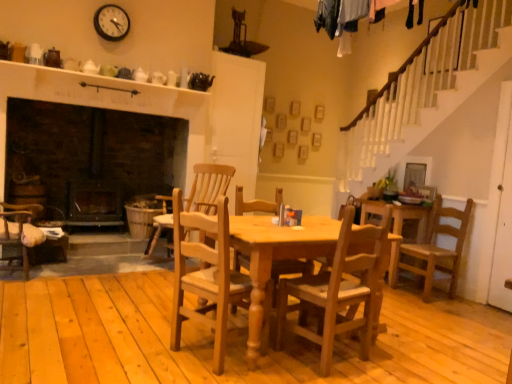
Question: Considering the relative positions of light brown wooden chair at right, the 3th chair viewed from the front, and light brown wood chair at center, which appears as the fourth chair when viewed from the right, in the image provided, is light brown wooden chair at right, the 3th chair viewed from the front, in front of light brown wood chair at center, which appears as the fourth chair when viewed from the right,?

Choices:
 (A) yes
 (B) no

Answer: (A)

Question: Is light brown wooden chair at right, the 3th chair viewed from the front, located outside light brown wood chair at center, which appears as the fourth chair when viewed from the right?

Choices:
 (A) yes
 (B) no

Answer: (A)

Question: Considering the relative sizes of light brown wooden chair at right, acting as the 1th chair starting from the right, and light brown wood chair at center, acting as the fourth chair starting from the front, in the image provided, is light brown wooden chair at right, acting as the 1th chair starting from the right, taller than light brown wood chair at center, acting as the fourth chair starting from the front,?

Choices:
 (A) no
 (B) yes

Answer: (A)

Question: Does light brown wooden chair at right, acting as the 1th chair starting from the right, have a smaller size compared to light brown wood chair at center, acting as the fourth chair starting from the front?

Choices:
 (A) yes
 (B) no

Answer: (A)

Question: Is there a large distance between light brown wooden chair at right, acting as the 1th chair starting from the right, and light brown wood chair at center, which appears as the fourth chair when viewed from the right?

Choices:
 (A) yes
 (B) no

Answer: (A)

Question: From a real-world perspective, is light brown wooden chair at right, the second chair from the back, located higher than light brown wood chair at center, arranged as the 1th chair when viewed from the back?

Choices:
 (A) no
 (B) yes

Answer: (A)

Question: Can you see light brown wood chair at center, the first chair when ordered from left to right, touching wooden chair at center, placed as the third chair when sorted from left to right?

Choices:
 (A) no
 (B) yes

Answer: (A)

Question: From a real-world perspective, is light brown wood chair at center, which appears as the fourth chair when viewed from the right, physically below wooden chair at center, the 2th chair when ordered from right to left?

Choices:
 (A) no
 (B) yes

Answer: (A)

Question: Can you confirm if light brown wood chair at center, the first chair when ordered from left to right, is smaller than wooden chair at center, which appears as the 2th chair when viewed from the front?

Choices:
 (A) no
 (B) yes

Answer: (A)

Question: From a real-world perspective, does light brown wood chair at center, arranged as the 1th chair when viewed from the back, stand above wooden chair at center, which appears as the 2th chair when viewed from the front?

Choices:
 (A) no
 (B) yes

Answer: (B)

Question: Does light brown wood chair at center, acting as the fourth chair starting from the front, have a larger size compared to wooden chair at center, placed as the third chair when sorted from left to right?

Choices:
 (A) yes
 (B) no

Answer: (A)

Question: Is light brown wood chair at center, which appears as the fourth chair when viewed from the right, taller than wooden chair at center, the 2th chair when ordered from right to left?

Choices:
 (A) no
 (B) yes

Answer: (B)

Question: Would you consider light brown wood chair at center, arranged as the 1th chair when viewed from the back, to be distant from light brown wooden chair at right, acting as the 1th chair starting from the right?

Choices:
 (A) yes
 (B) no

Answer: (A)